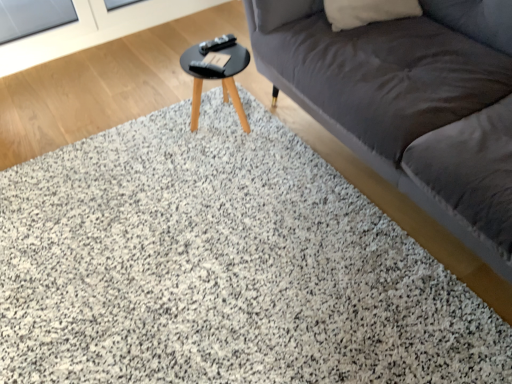
Describe the element at coordinates (367, 12) in the screenshot. I see `white soft pillow at upper right` at that location.

Find the location of a particular element. black glossy table at center is located at coordinates (216, 71).

The width and height of the screenshot is (512, 384). What do you see at coordinates (93, 30) in the screenshot? I see `transparent glass screen door at upper left` at bounding box center [93, 30].

Measure the distance between point (72, 39) and camera.

The distance of point (72, 39) from camera is 2.53 meters.

This screenshot has width=512, height=384. Find the location of `dark gray fabric couch at upper right`. dark gray fabric couch at upper right is located at coordinates (406, 107).

Locate an element on the screen. The image size is (512, 384). white soft pillow at upper right is located at coordinates (367, 12).

How distant is white soft pillow at upper right from black glossy table at center?

white soft pillow at upper right is 21.66 inches from black glossy table at center.

Would you say white soft pillow at upper right is a long distance from black glossy table at center?

white soft pillow at upper right is near black glossy table at center, not far away.

You are a GUI agent. You are given a task and a screenshot of the screen. Output one action in this format:
    pyautogui.click(x=<x>, y=<y>)
    Task: Click on the pillow on the right side of black glossy table at center
    The width and height of the screenshot is (512, 384).
    Given the screenshot: What is the action you would take?
    pyautogui.click(x=367, y=12)

From the picture: Considering the relative sizes of white soft pillow at upper right and black glossy table at center in the image provided, is white soft pillow at upper right bigger than black glossy table at center?

No, white soft pillow at upper right is not bigger than black glossy table at center.

Is point (244, 125) more distant than point (104, 39)?

That is False.

Is black glossy table at center next to transparent glass screen door at upper left and touching it?

No, black glossy table at center is not beside transparent glass screen door at upper left.

From the image's perspective, is black glossy table at center under transparent glass screen door at upper left?

Indeed, from the image's perspective, black glossy table at center is shown beneath transparent glass screen door at upper left.

Which object is positioned more to the left, black glossy table at center or transparent glass screen door at upper left?

Positioned to the left is transparent glass screen door at upper left.

From the picture: Is transparent glass screen door at upper left bigger than black glossy table at center?

Yes.

What's the angular difference between transparent glass screen door at upper left and black glossy table at center's facing directions?

transparent glass screen door at upper left and black glossy table at center are facing 90.2 degrees away from each other.

Is transparent glass screen door at upper left placed right next to black glossy table at center?

transparent glass screen door at upper left and black glossy table at center are clearly separated.

Which is in front, transparent glass screen door at upper left or black glossy table at center?

black glossy table at center is in front.

From a real-world perspective, is dark gray fabric couch at upper right beneath black glossy table at center?

No, from a real-world perspective, dark gray fabric couch at upper right is not below black glossy table at center.

Visually, is dark gray fabric couch at upper right positioned to the left or to the right of black glossy table at center?

dark gray fabric couch at upper right is to the right of black glossy table at center.

Considering the positions of points (449, 126) and (228, 62), is point (449, 126) closer to camera compared to point (228, 62)?

Yes, point (449, 126) is in front of point (228, 62).

Considering the positions of objects black glossy table at center and dark gray fabric couch at upper right in the image provided, who is behind, black glossy table at center or dark gray fabric couch at upper right?

Positioned behind is black glossy table at center.

Find the location of a particular element. The height and width of the screenshot is (384, 512). studio couch positioned vertically above the black glossy table at center (from a real-world perspective) is located at coordinates (406, 107).

From the picture: Between black glossy table at center and dark gray fabric couch at upper right, which one has smaller width?

black glossy table at center is thinner.

Can you tell me how much transparent glass screen door at upper left and dark gray fabric couch at upper right differ in facing direction?

There is a 90.2-degree angle between the facing directions of transparent glass screen door at upper left and dark gray fabric couch at upper right.

Between transparent glass screen door at upper left and dark gray fabric couch at upper right, which one has smaller width?

transparent glass screen door at upper left is thinner.

Considering the positions of objects transparent glass screen door at upper left and dark gray fabric couch at upper right in the image provided, who is more to the left, transparent glass screen door at upper left or dark gray fabric couch at upper right?

transparent glass screen door at upper left is more to the left.

From a real-world perspective, is transparent glass screen door at upper left positioned under dark gray fabric couch at upper right based on gravity?

Yes, from a real-world perspective, transparent glass screen door at upper left is under dark gray fabric couch at upper right.

From a real-world perspective, is dark gray fabric couch at upper right above or below transparent glass screen door at upper left?

From a real-world perspective, dark gray fabric couch at upper right is physically above transparent glass screen door at upper left.

Does dark gray fabric couch at upper right turn towards transparent glass screen door at upper left?

No, dark gray fabric couch at upper right is not aimed at transparent glass screen door at upper left.

Based on the photo, can you tell me how much dark gray fabric couch at upper right and transparent glass screen door at upper left differ in facing direction?

They differ by 90.2 degrees in their facing directions.

Is dark gray fabric couch at upper right placed right next to transparent glass screen door at upper left?

There is a gap between dark gray fabric couch at upper right and transparent glass screen door at upper left.

You are a GUI agent. You are given a task and a screenshot of the screen. Output one action in this format:
    pyautogui.click(x=<x>, y=<y>)
    Task: Click on the pillow behind the black glossy table at center
    This screenshot has height=384, width=512.
    Given the screenshot: What is the action you would take?
    pyautogui.click(x=367, y=12)

Where is `table below the transparent glass screen door at upper left (from the image's perspective)`? Image resolution: width=512 pixels, height=384 pixels. table below the transparent glass screen door at upper left (from the image's perspective) is located at coordinates (216, 71).

When comparing their distances from transparent glass screen door at upper left, does dark gray fabric couch at upper right or black glossy table at center seem closer?

black glossy table at center is positioned closer to the anchor transparent glass screen door at upper left.

Considering their positions, is transparent glass screen door at upper left positioned closer to black glossy table at center than white soft pillow at upper right?

Among the two, white soft pillow at upper right is located nearer to black glossy table at center.

Which object lies further to the anchor point dark gray fabric couch at upper right, white soft pillow at upper right or black glossy table at center?

Among the two, black glossy table at center is located further to dark gray fabric couch at upper right.

Which object lies nearer to the anchor point white soft pillow at upper right, dark gray fabric couch at upper right or transparent glass screen door at upper left?

Based on the image, dark gray fabric couch at upper right appears to be nearer to white soft pillow at upper right.

From the image, which object appears to be farther from transparent glass screen door at upper left, white soft pillow at upper right or dark gray fabric couch at upper right?

dark gray fabric couch at upper right is further to transparent glass screen door at upper left.

Looking at the image, which one is located further to black glossy table at center, white soft pillow at upper right or transparent glass screen door at upper left?

transparent glass screen door at upper left.

From the image, which object appears to be farther from transparent glass screen door at upper left, dark gray fabric couch at upper right or white soft pillow at upper right?

Based on the image, dark gray fabric couch at upper right appears to be further to transparent glass screen door at upper left.

When comparing their distances from white soft pillow at upper right, does black glossy table at center or transparent glass screen door at upper left seem closer?

The object closer to white soft pillow at upper right is black glossy table at center.

In order to click on table positioned between dark gray fabric couch at upper right and white soft pillow at upper right from near to far in this screenshot , I will do `click(216, 71)`.

Where is `table situated between transparent glass screen door at upper left and white soft pillow at upper right from left to right`? The image size is (512, 384). table situated between transparent glass screen door at upper left and white soft pillow at upper right from left to right is located at coordinates (216, 71).

The height and width of the screenshot is (384, 512). In order to click on table between transparent glass screen door at upper left and dark gray fabric couch at upper right in this screenshot , I will do `click(216, 71)`.

Locate an element on the screen. This screenshot has width=512, height=384. pillow located between transparent glass screen door at upper left and dark gray fabric couch at upper right in the left-right direction is located at coordinates (367, 12).